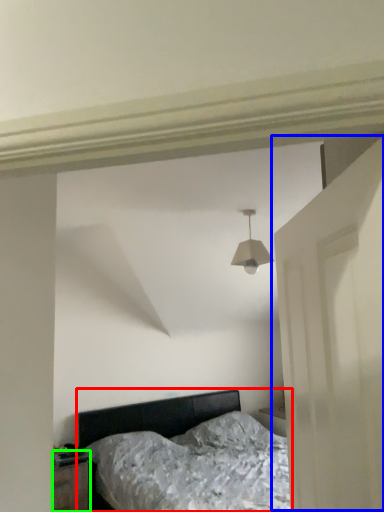
Question: Based on their relative distances, which object is farther from bed (highlighted by a red box)? Choose from door (highlighted by a blue box) and nightstand (highlighted by a green box).

Choices:
 (A) door
 (B) nightstand

Answer: (A)